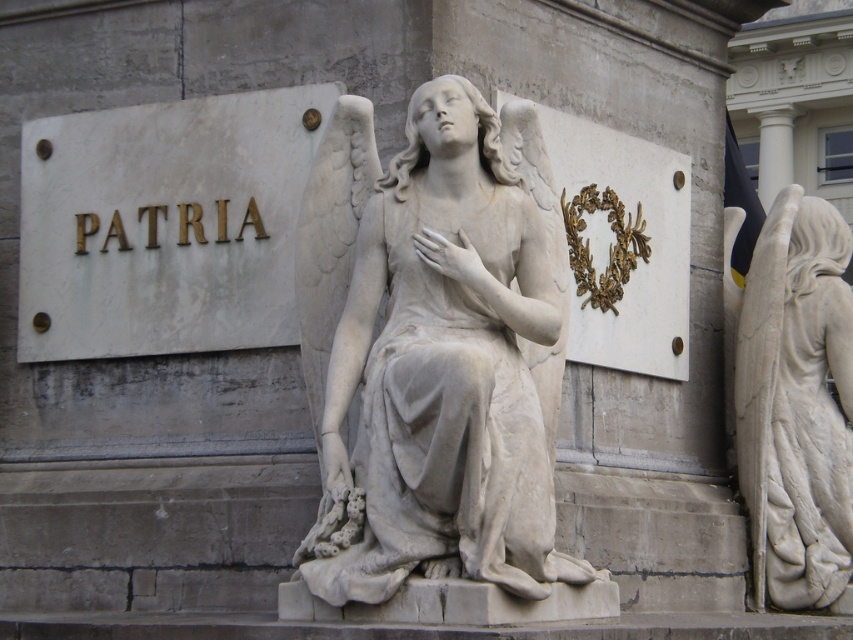
Based on the photo, you are standing in front of the sculpture and want to read the inscription on the plaque. Considering the distance between the white marble sign at upper left and the white marble statue at right, can you estimate if you need to move closer to read it clearly?

The white marble sign at upper left and white marble statue at right are 13.93 meters apart. Since the sign is at the upper left and the statue is at the right, you would need to move closer to the white marble sign at upper left to read its inscription clearly as it might be too far away from your current position.

You are an art conservator assessing the stability of the white marble statue at center and the white marble sign at upper left. Considering their widths, which object might be more prone to toppling over in a minor earthquake?

The white marble statue at center is thinner than the white marble sign at upper left, making it more prone to toppling over in a minor earthquake due to its narrower base.